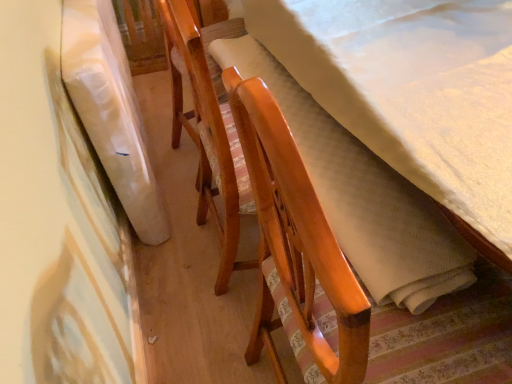
Question: Does wooden chair with striped cushion at center have a greater height compared to white fabric at left?

Choices:
 (A) no
 (B) yes

Answer: (B)

Question: Is wooden chair with striped cushion at center to the left of white fabric at left from the viewer's perspective?

Choices:
 (A) yes
 (B) no

Answer: (B)

Question: Considering the relative sizes of wooden chair with striped cushion at center and white fabric at left in the image provided, is wooden chair with striped cushion at center bigger than white fabric at left?

Choices:
 (A) yes
 (B) no

Answer: (A)

Question: From a real-world perspective, is wooden chair with striped cushion at center positioned over white fabric at left based on gravity?

Choices:
 (A) yes
 (B) no

Answer: (A)

Question: From the image's perspective, is wooden chair with striped cushion at center above white fabric at left?

Choices:
 (A) yes
 (B) no

Answer: (B)

Question: Is wooden chair with striped cushion at center turned away from white fabric at left?

Choices:
 (A) no
 (B) yes

Answer: (A)

Question: Is white fabric at left directly adjacent to wooden chair with striped cushion at center?

Choices:
 (A) yes
 (B) no

Answer: (B)

Question: Does white fabric at left have a smaller size compared to wooden chair with striped cushion at center?

Choices:
 (A) no
 (B) yes

Answer: (B)

Question: Does white fabric at left have a lesser width compared to wooden chair with striped cushion at center?

Choices:
 (A) no
 (B) yes

Answer: (B)

Question: Is white fabric at left not near wooden chair with striped cushion at center?

Choices:
 (A) yes
 (B) no

Answer: (B)

Question: Is white fabric at left surrounding wooden chair with striped cushion at center?

Choices:
 (A) yes
 (B) no

Answer: (B)

Question: Is wooden chair with striped cushion at center at the back of white fabric at left?

Choices:
 (A) yes
 (B) no

Answer: (B)

Question: Looking at their shapes, would you say wooden chair with striped cushion at center is wider or thinner than white fabric at left?

Choices:
 (A) thin
 (B) wide

Answer: (B)